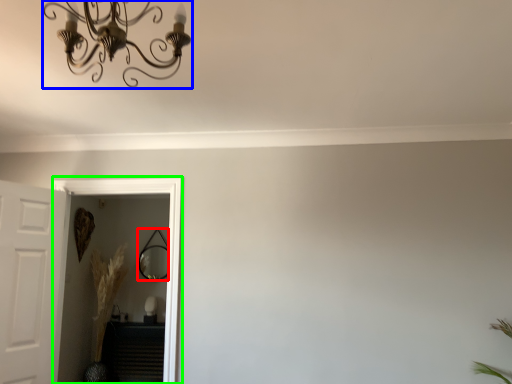
Question: Which is nearer to the mirror (highlighted by a red box)? light fixture (highlighted by a blue box) or glass door (highlighted by a green box).

Choices:
 (A) light fixture
 (B) glass door

Answer: (B)